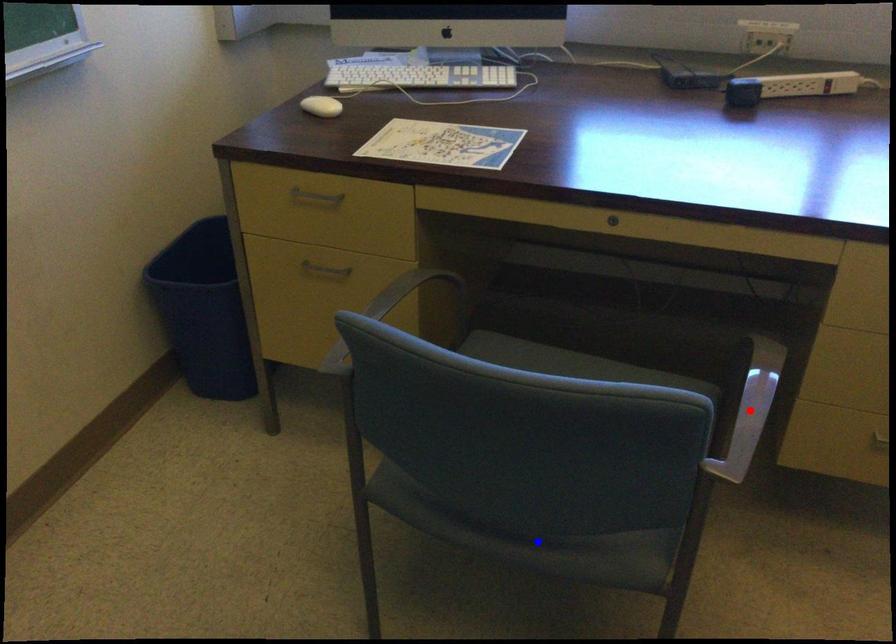
Question: In the image, two points are highlighted. Which point is nearer to the camera? Reply with the corresponding letter.

Choices:
 (A) blue point
 (B) red point

Answer: (A)